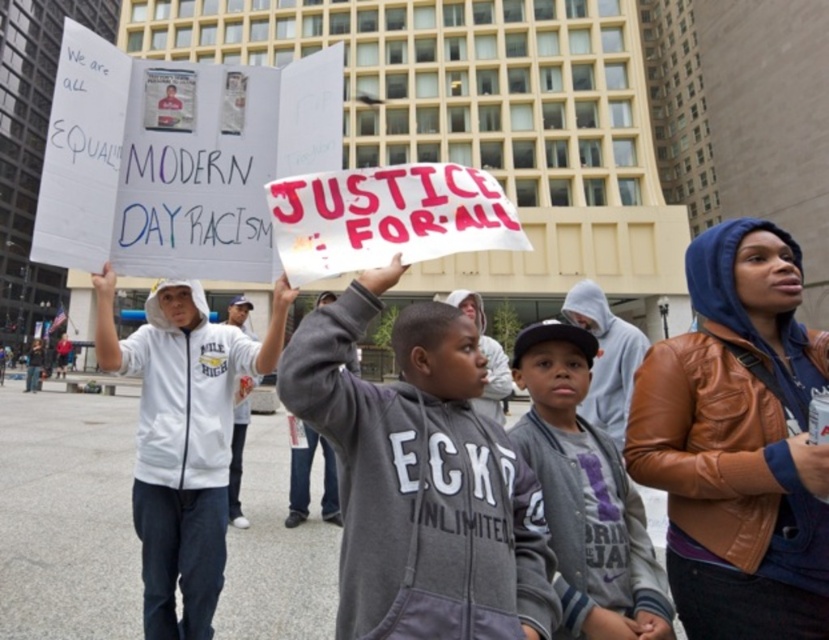
Between point (721, 556) and point (410, 332), which one is positioned in front?

Point (721, 556)

Does brown leather jacket at center have a smaller size compared to gray fleece sweatshirt at center?

Incorrect, brown leather jacket at center is not smaller in size than gray fleece sweatshirt at center.

You are a GUI agent. You are given a task and a screenshot of the screen. Output one action in this format:
    pyautogui.click(x=<x>, y=<y>)
    Task: Click on the brown leather jacket at center
    Image resolution: width=829 pixels, height=640 pixels.
    Given the screenshot: What is the action you would take?
    pyautogui.click(x=738, y=442)

This screenshot has height=640, width=829. What are the coordinates of `brown leather jacket at center` in the screenshot? It's located at (738, 442).

Can you confirm if brown leather jacket at center is positioned below white hoodie at center?

No.

Between brown leather jacket at center and white hoodie at center, which one appears on the right side from the viewer's perspective?

brown leather jacket at center

Find the location of a particular element. Image resolution: width=829 pixels, height=640 pixels. brown leather jacket at center is located at coordinates (738, 442).

Can you confirm if gray fleece sweatshirt at center is wider than gray fleece jacket at center?

Correct, the width of gray fleece sweatshirt at center exceeds that of gray fleece jacket at center.

Does gray fleece sweatshirt at center appear on the right side of gray fleece jacket at center?

No, gray fleece sweatshirt at center is not to the right of gray fleece jacket at center.

Is point (285, 369) behind point (607, 560)?

No, it is in front of (607, 560).

This screenshot has width=829, height=640. Identify the location of gray fleece sweatshirt at center. (419, 467).